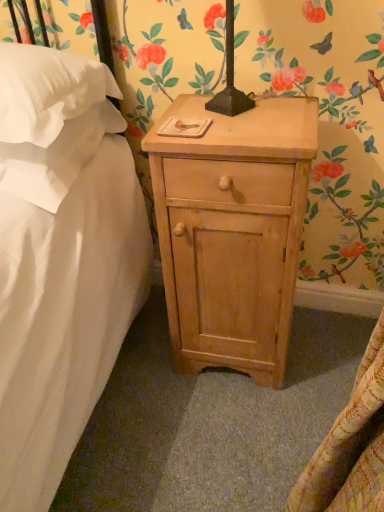
This screenshot has width=384, height=512. Find the location of `free location in front of natural wood nightstand at center`. free location in front of natural wood nightstand at center is located at coordinates (231, 436).